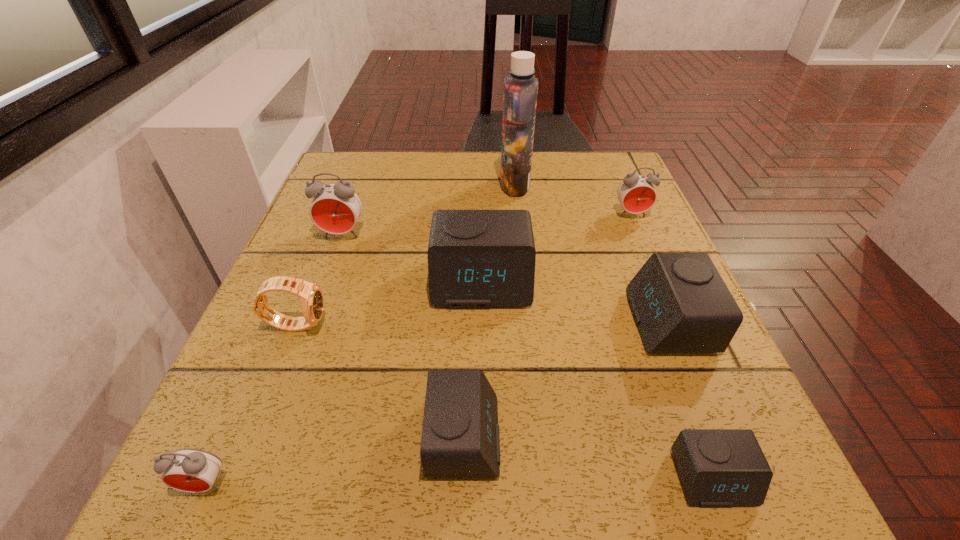
Identify the location of vacant space at the left edge of the desktop. (252, 335).

Locate an element on the screen. free space at the right edge is located at coordinates (610, 214).

At what (x,y) coordinates should I click in order to perform the action: click on vacant space at the far left corner of the desktop. Please return your answer as a coordinate pair (x, y). Image resolution: width=960 pixels, height=540 pixels. Looking at the image, I should click on (384, 166).

In the image, there is a desktop. Where is `free space at the near left corner`? The image size is (960, 540). free space at the near left corner is located at coordinates (161, 511).

Image resolution: width=960 pixels, height=540 pixels. In the image, there is a desktop. In order to click on vacant space at the far right corner in this screenshot , I will do `click(582, 150)`.

Where is `free space between the blue shampoo and the shortest object`? The image size is (960, 540). free space between the blue shampoo and the shortest object is located at coordinates (614, 332).

Locate an element on the screen. free space between the smallest red alarm clock and the biggest black alarm clock is located at coordinates (344, 383).

Where is `blank region between the smallest black alarm clock and the black watch`? Image resolution: width=960 pixels, height=540 pixels. blank region between the smallest black alarm clock and the black watch is located at coordinates (505, 401).

I want to click on vacant area that lies between the blue shampoo and the second biggest red alarm clock, so click(x=573, y=200).

The width and height of the screenshot is (960, 540). Find the location of `unoccupied area between the smallest black alarm clock and the biggest black alarm clock`. unoccupied area between the smallest black alarm clock and the biggest black alarm clock is located at coordinates (597, 380).